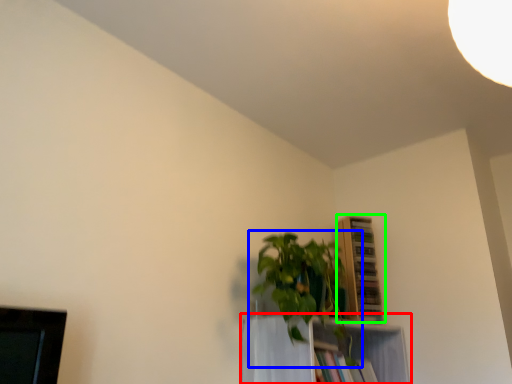
Question: Based on their relative distances, which object is farther from shelf (highlighted by a red box)? Choose from houseplant (highlighted by a blue box) and shelf (highlighted by a green box).

Choices:
 (A) houseplant
 (B) shelf

Answer: (B)